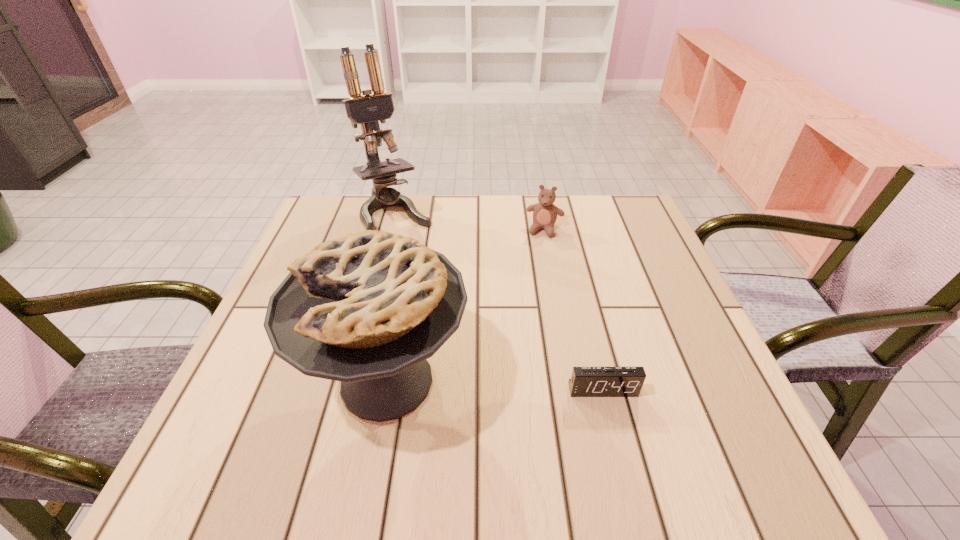
This screenshot has width=960, height=540. Find the location of `vacant space located 0.060m at the eyepieces of the microscope`. vacant space located 0.060m at the eyepieces of the microscope is located at coordinates (415, 253).

Locate an element on the screen. free space located 0.320m at the eyepieces of the microscope is located at coordinates (457, 323).

Locate an element on the screen. This screenshot has width=960, height=540. free space located 0.190m at the eyepieces of the microscope is located at coordinates (434, 285).

The width and height of the screenshot is (960, 540). Find the location of `teddy bear at the far edge`. teddy bear at the far edge is located at coordinates tap(545, 213).

You are a GUI agent. You are given a task and a screenshot of the screen. Output one action in this format:
    pyautogui.click(x=<x>, y=<y>)
    Task: Click on the microscope that is at the far edge
    The image size is (960, 540).
    Given the screenshot: What is the action you would take?
    pyautogui.click(x=367, y=110)

Where is `pie that is at the near edge`? The image size is (960, 540). pie that is at the near edge is located at coordinates (367, 309).

Where is `alarm clock that is at the near edge`? alarm clock that is at the near edge is located at coordinates (585, 381).

Find the location of a particular element. The width and height of the screenshot is (960, 540). pie at the left edge is located at coordinates (367, 309).

Find the location of `microscope at the left edge`. microscope at the left edge is located at coordinates (367, 110).

The image size is (960, 540). Identify the location of object positioned at the far left corner. (367, 110).